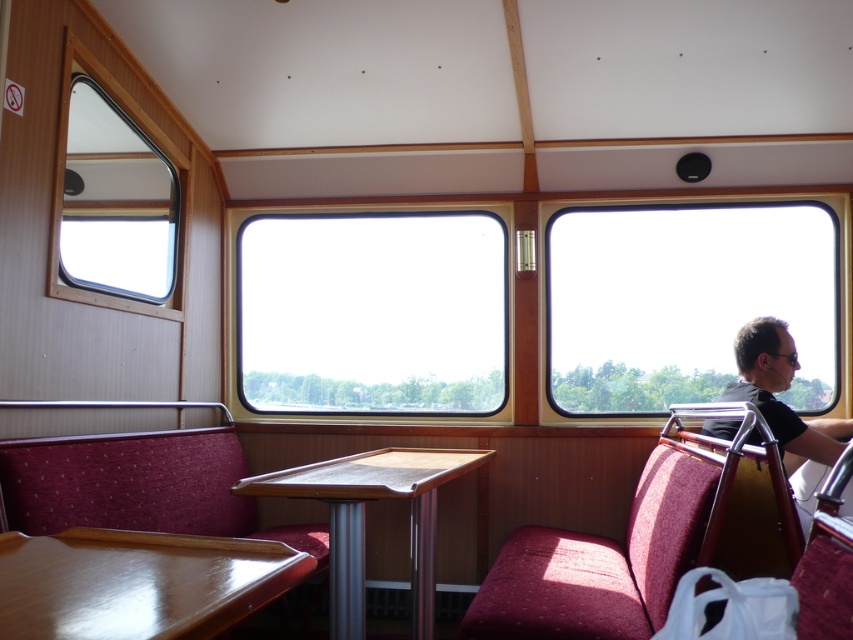
You are a passenger sitting in the vintage train car and want to enjoy the view outside. The transparent glass window at right and the matte black shirt at right are both on your right side. Which object allows you to see the scenery outside better?

The transparent glass window at right allows you to see the scenery outside better because it is larger in size than the matte black shirt at right.